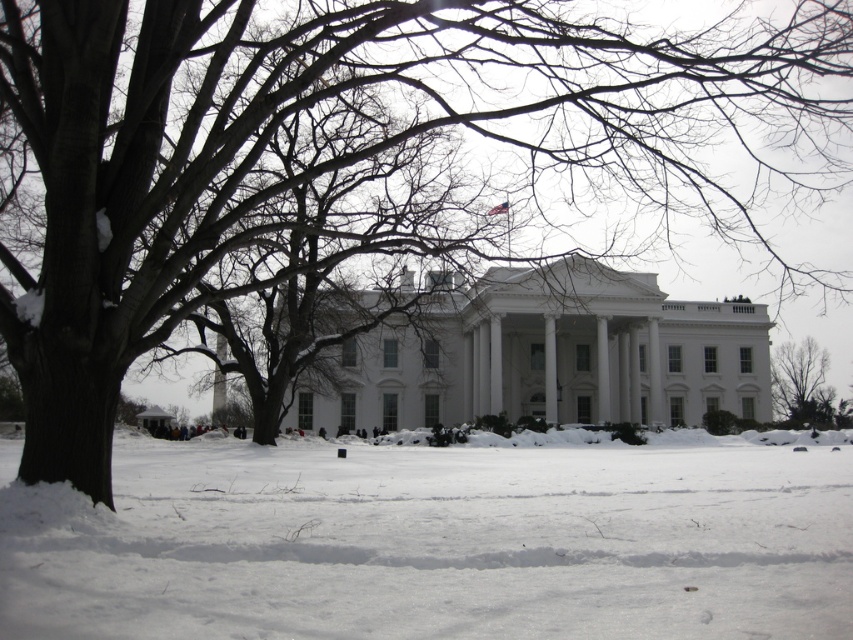
At what (x,y) coordinates should I click in order to perform the action: click on white fluffy snow at center. Please return your answer as a coordinate pair (x, y). Looking at the image, I should click on 433,544.

Does point (219, 573) come farther from viewer compared to point (804, 388)?

No, (219, 573) is closer to viewer.

Where is `white fluffy snow at center`? The image size is (853, 640). white fluffy snow at center is located at coordinates (433, 544).